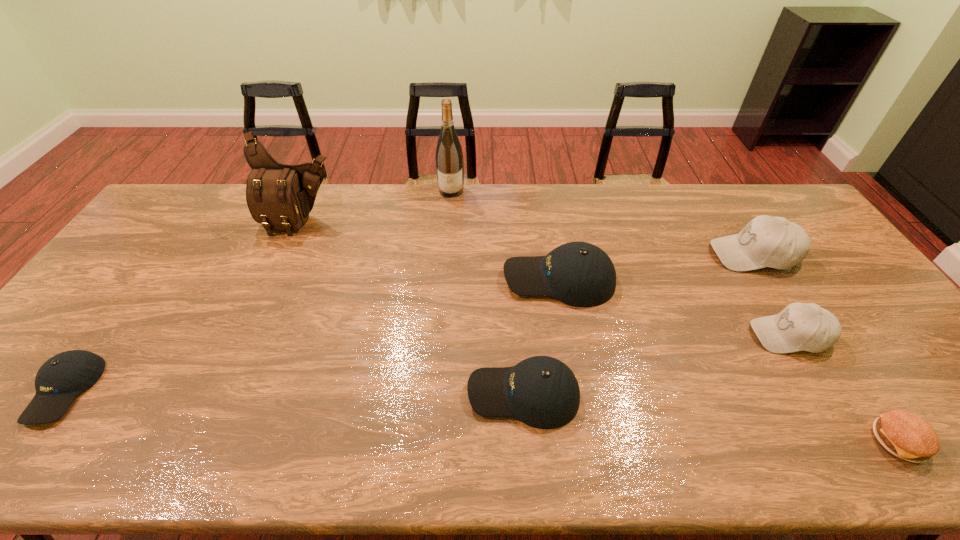
You are a GUI agent. You are given a task and a screenshot of the screen. Output one action in this format:
    pyautogui.click(x=<x>, y=<y>)
    Task: Click on the hamburger
    
    Given the screenshot: What is the action you would take?
    pyautogui.click(x=905, y=435)

Locate an element on the screen. free location located 0.050m on the label of the sixth object from right to left is located at coordinates (450, 207).

At what (x,y) coordinates should I click in order to perform the action: click on free space located on the front-facing side of the seventh object from right to left. Please return your answer as a coordinate pair (x, y). The width and height of the screenshot is (960, 540). Looking at the image, I should click on (278, 275).

Where is `free spot located on the front-facing side of the bigger gray baseball cap`? The width and height of the screenshot is (960, 540). free spot located on the front-facing side of the bigger gray baseball cap is located at coordinates (679, 254).

Locate an element on the screen. The width and height of the screenshot is (960, 540). vacant space located on the front-facing side of the bigger gray baseball cap is located at coordinates (628, 254).

You are a GUI agent. You are given a task and a screenshot of the screen. Output one action in this format:
    pyautogui.click(x=<x>, y=<y>)
    Task: Click on the free space located on the front-facing side of the bigger gray baseball cap
    
    Given the screenshot: What is the action you would take?
    pyautogui.click(x=695, y=254)

You are a GUI agent. You are given a task and a screenshot of the screen. Output one action in this format:
    pyautogui.click(x=<x>, y=<y>)
    Task: Click on the vacant space located 0.380m on the front-facing side of the biggest blue baseball cap
    Image resolution: width=960 pixels, height=540 pixels.
    Given the screenshot: What is the action you would take?
    tap(374, 279)

Find the location of `vacant space located on the front-facing side of the biggest blue baseball cap`. vacant space located on the front-facing side of the biggest blue baseball cap is located at coordinates [456, 279].

The height and width of the screenshot is (540, 960). Find the location of `vacant space situated on the front-facing side of the biggest blue baseball cap`. vacant space situated on the front-facing side of the biggest blue baseball cap is located at coordinates (392, 279).

Locate an element on the screen. Image resolution: width=960 pixels, height=540 pixels. vacant region located on the front-facing side of the smaller gray baseball cap is located at coordinates (622, 335).